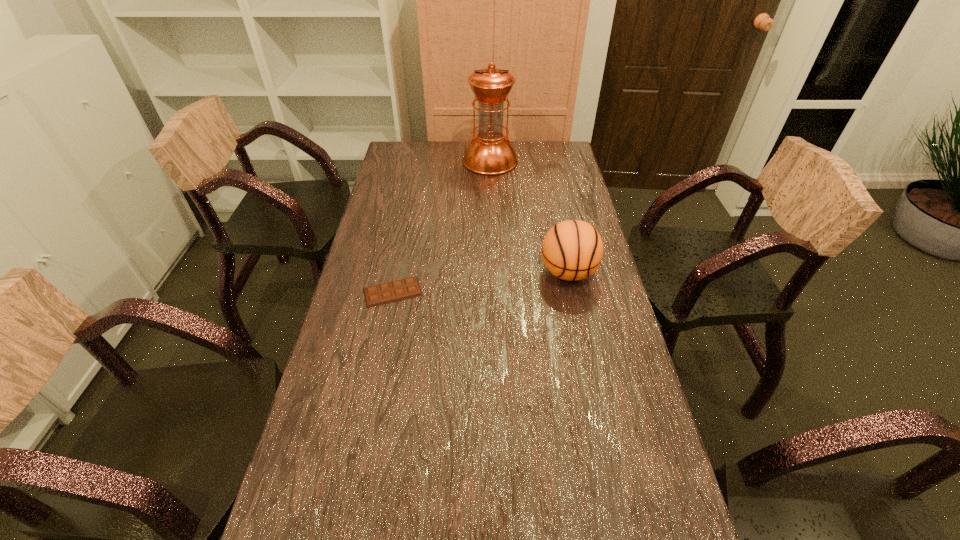
Locate an element on the screen. object positioned at the left edge is located at coordinates (380, 294).

This screenshot has height=540, width=960. In order to click on object that is at the right edge in this screenshot , I will do `click(572, 250)`.

I want to click on vacant space at the left edge, so click(x=363, y=414).

Identify the location of free space at the right edge of the desktop. (670, 522).

In the image, there is a desktop. At what (x,y) coordinates should I click in order to perform the action: click on vacant region at the far left corner. Please return your answer as a coordinate pair (x, y). Image resolution: width=960 pixels, height=540 pixels. Looking at the image, I should click on (391, 149).

Find the location of `vacant space at the far right corner of the desktop`. vacant space at the far right corner of the desktop is located at coordinates (555, 146).

This screenshot has width=960, height=540. Identify the location of vacant region between the tallest object and the shortest object. [x=442, y=226].

This screenshot has width=960, height=540. In order to click on free spot between the tallest object and the leftmost object in this screenshot , I will do `click(442, 226)`.

Where is `vacant point located between the basketball and the shortest object`? This screenshot has height=540, width=960. vacant point located between the basketball and the shortest object is located at coordinates (480, 282).

I want to click on unoccupied area between the tallest object and the rightmost object, so click(x=529, y=217).